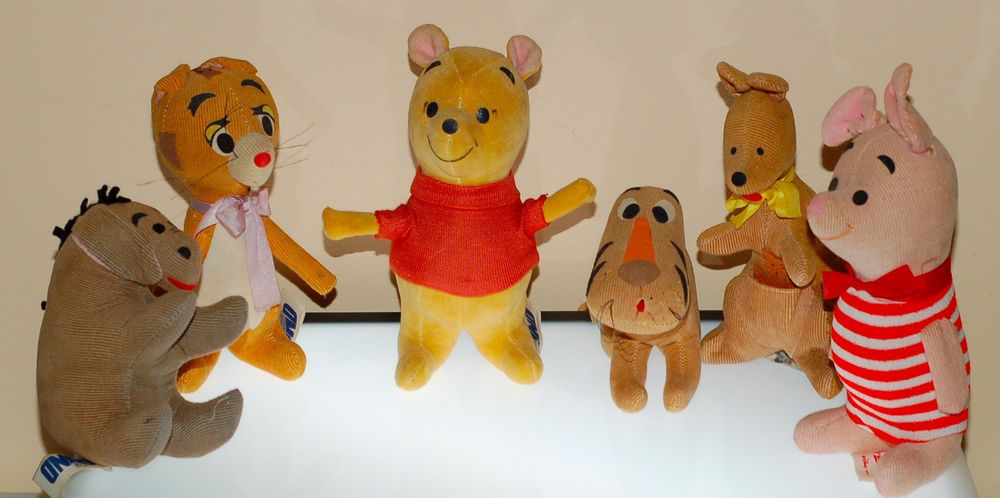
Locate an element on the screen. This screenshot has height=498, width=1000. ears on stuffed animals is located at coordinates (113, 239), (178, 88), (244, 64), (423, 47), (519, 52), (778, 84), (736, 81), (862, 107), (895, 106).